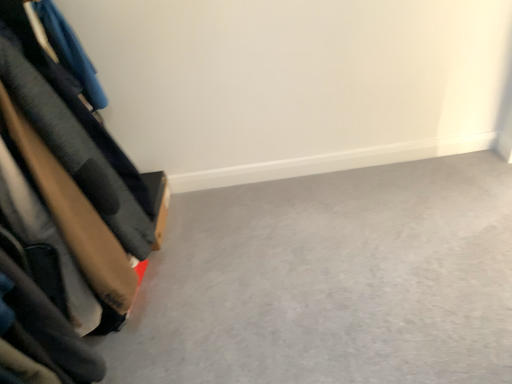
Question: In terms of size, does velvet-like fabric couch at left appear bigger or smaller than smooth gray carpet at lower left?

Choices:
 (A) big
 (B) small

Answer: (A)

Question: Looking at their shapes, would you say velvet-like fabric couch at left is wider or thinner than smooth gray carpet at lower left?

Choices:
 (A) wide
 (B) thin

Answer: (B)

Question: Considering the positions of velvet-like fabric couch at left and smooth gray carpet at lower left in the image, is velvet-like fabric couch at left taller or shorter than smooth gray carpet at lower left?

Choices:
 (A) short
 (B) tall

Answer: (B)

Question: Is smooth gray carpet at lower left to the left or to the right of velvet-like fabric couch at left in the image?

Choices:
 (A) left
 (B) right

Answer: (B)

Question: From a real-world perspective, is smooth gray carpet at lower left physically located above or below velvet-like fabric couch at left?

Choices:
 (A) above
 (B) below

Answer: (B)

Question: Is smooth gray carpet at lower left situated inside velvet-like fabric couch at left or outside?

Choices:
 (A) inside
 (B) outside

Answer: (B)

Question: From their relative heights in the image, would you say smooth gray carpet at lower left is taller or shorter than velvet-like fabric couch at left?

Choices:
 (A) short
 (B) tall

Answer: (A)